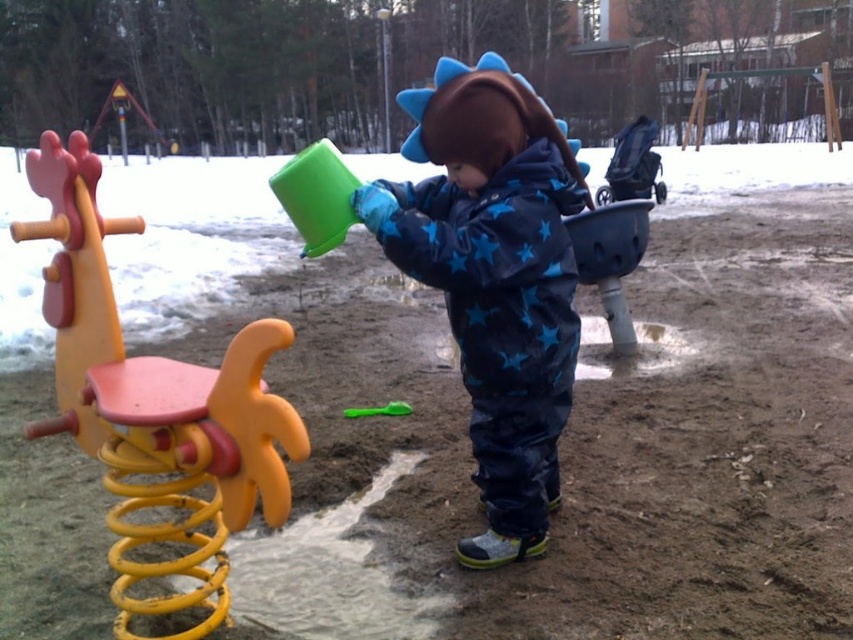
You are a parent supervising a child at a winter playground. You notice two items on the ground near the child. The items are the yellow plastic spring at left and the green plastic spoon at center. Which item is closer to the left side of the playground?

The yellow plastic spring at left is closer to the left side of the playground because it is positioned to the left of the green plastic spoon at center.